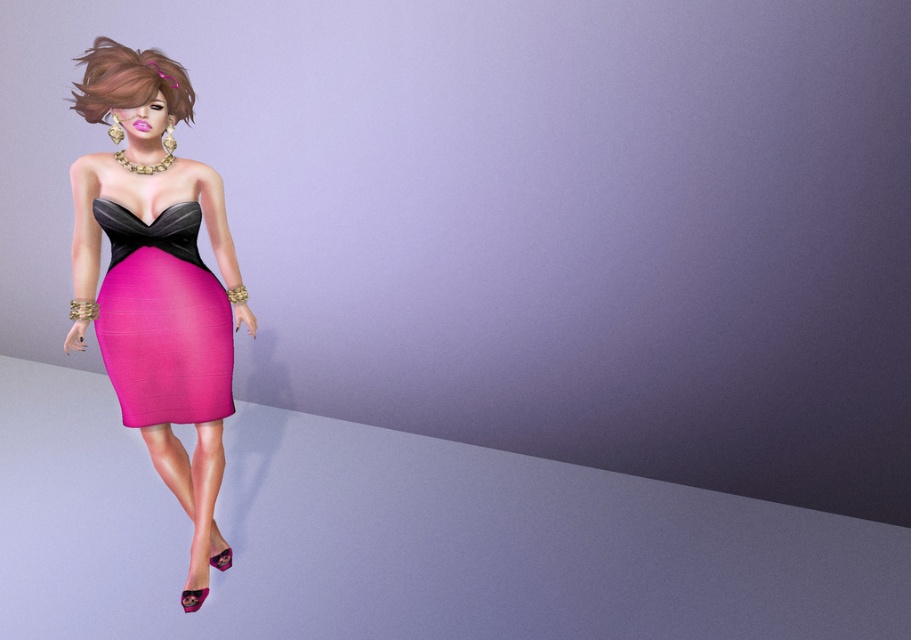
Question: Among these points, which one is farthest from the camera?

Choices:
 (A) (125, 100)
 (B) (123, 380)
 (C) (218, 349)

Answer: (C)

Question: Can you confirm if matte pink fabric dress at left is positioned below brown shiny hair at upper left?

Choices:
 (A) yes
 (B) no

Answer: (A)

Question: Which of the following is the farthest from the observer?

Choices:
 (A) matte pink fabric dress at left
 (B) brown shiny hair at upper left
 (C) matte pink dress at left

Answer: (A)

Question: Can you confirm if matte pink fabric dress at left is thinner than brown shiny hair at upper left?

Choices:
 (A) yes
 (B) no

Answer: (B)

Question: Which point is closer to the camera taking this photo?

Choices:
 (A) (152, 58)
 (B) (111, 202)

Answer: (A)

Question: Does matte pink fabric dress at left appear on the right side of brown shiny hair at upper left?

Choices:
 (A) yes
 (B) no

Answer: (A)